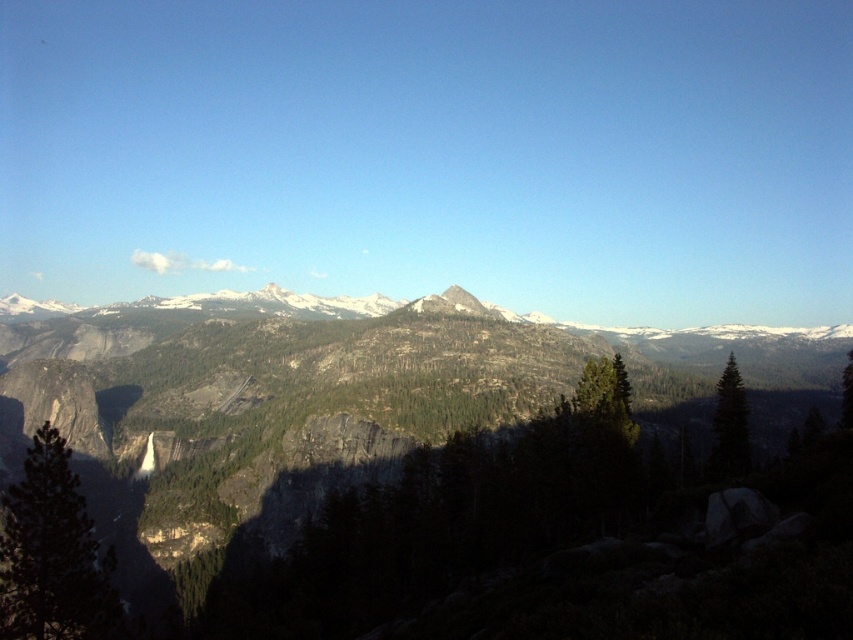
Looking at this image, does green matte tree at lower left appear on the left side of green matte tree at right?

Correct, you'll find green matte tree at lower left to the left of green matte tree at right.

Does point (20, 580) lie in front of point (737, 474)?

Yes, it is.

Where is `green matte tree at lower left`? This screenshot has width=853, height=640. green matte tree at lower left is located at coordinates (51, 554).

You are a GUI agent. You are given a task and a screenshot of the screen. Output one action in this format:
    pyautogui.click(x=<x>, y=<y>)
    Task: Click on the green matte tree at lower left
    The image size is (853, 640).
    Given the screenshot: What is the action you would take?
    pyautogui.click(x=51, y=554)

Between rocky mountain range at center and green matte tree at lower left, which one has less height?

green matte tree at lower left is shorter.

Who is more distant from viewer, (312, 323) or (39, 456)?

The point (312, 323) is behind.

Is point (270, 374) positioned in front of point (79, 564)?

No.

The width and height of the screenshot is (853, 640). I want to click on rocky mountain range at center, so click(384, 474).

Is rocky mountain range at center to the left of green matte tree at center from the viewer's perspective?

Correct, you'll find rocky mountain range at center to the left of green matte tree at center.

Is rocky mountain range at center to the right of green matte tree at center from the viewer's perspective?

No, rocky mountain range at center is not to the right of green matte tree at center.

Locate an element on the screen. The image size is (853, 640). rocky mountain range at center is located at coordinates (384, 474).